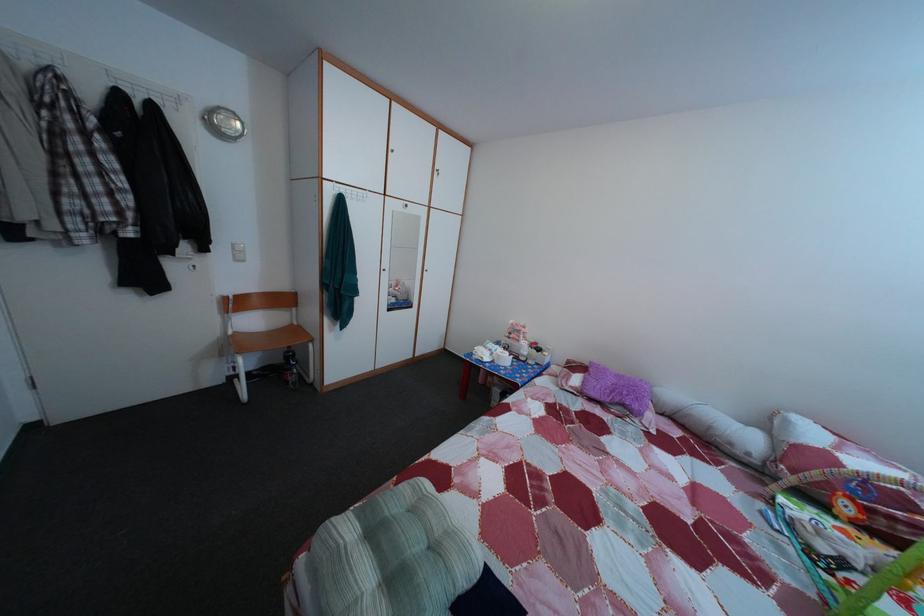
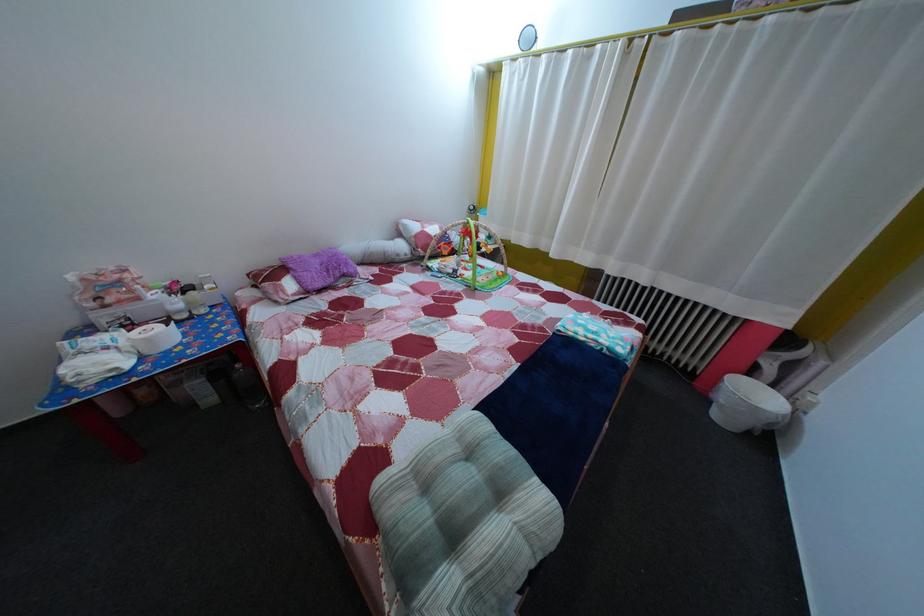
Find the pixel in the second image that matches point 628,384 in the first image.

(325, 262)